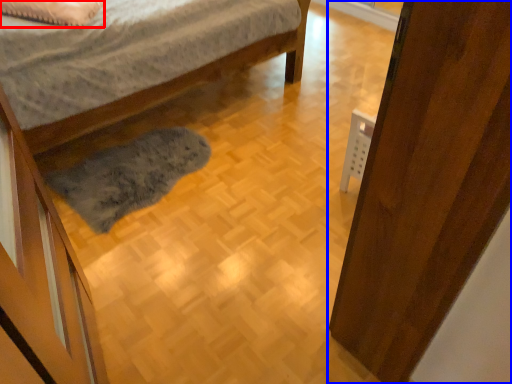
Question: Among these objects, which one is nearest to the camera, pillow (highlighted by a red box) or door (highlighted by a blue box)?

Choices:
 (A) pillow
 (B) door

Answer: (B)